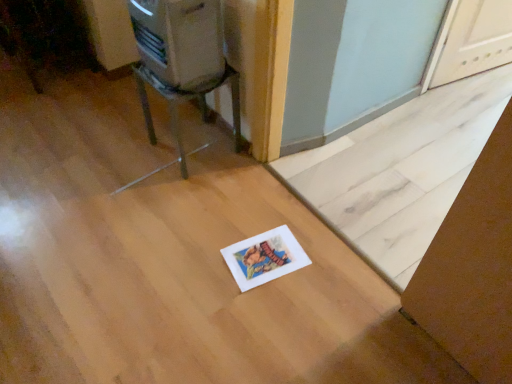
Question: Is white paper at lower center outside of metallic silver chair at upper left?

Choices:
 (A) no
 (B) yes

Answer: (B)

Question: Does white paper at lower center have a lesser height compared to metallic silver chair at upper left?

Choices:
 (A) yes
 (B) no

Answer: (A)

Question: Could metallic silver chair at upper left be considered to be inside white paper at lower center?

Choices:
 (A) yes
 (B) no

Answer: (B)

Question: Is white paper at lower center turned away from metallic silver chair at upper left?

Choices:
 (A) yes
 (B) no

Answer: (B)

Question: Can you confirm if white paper at lower center is thinner than metallic silver chair at upper left?

Choices:
 (A) yes
 (B) no

Answer: (B)

Question: Could you tell me if white paper at lower center is facing metallic silver chair at upper left?

Choices:
 (A) no
 (B) yes

Answer: (A)

Question: Is there a large distance between metallic silver chair at upper left and white paper at lower center?

Choices:
 (A) no
 (B) yes

Answer: (A)

Question: Is metallic silver chair at upper left positioned before white paper at lower center?

Choices:
 (A) yes
 (B) no

Answer: (B)

Question: Is metallic silver chair at upper left positioned with its back to white paper at lower center?

Choices:
 (A) no
 (B) yes

Answer: (A)

Question: From the image's perspective, is metallic silver chair at upper left under white paper at lower center?

Choices:
 (A) yes
 (B) no

Answer: (B)

Question: Does metallic silver chair at upper left have a larger size compared to white paper at lower center?

Choices:
 (A) no
 (B) yes

Answer: (A)

Question: From a real-world perspective, is metallic silver chair at upper left located higher than white paper at lower center?

Choices:
 (A) no
 (B) yes

Answer: (B)

Question: Does white paper at lower center have a larger size compared to metallic silver appliance at upper left?

Choices:
 (A) no
 (B) yes

Answer: (B)